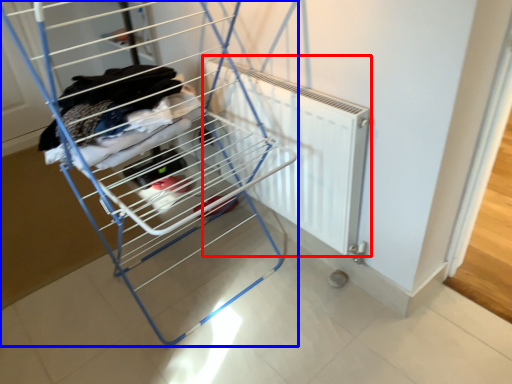
Question: Which object appears farthest to the camera in this image, radiator (highlighted by a red box) or furniture (highlighted by a blue box)?

Choices:
 (A) radiator
 (B) furniture

Answer: (A)